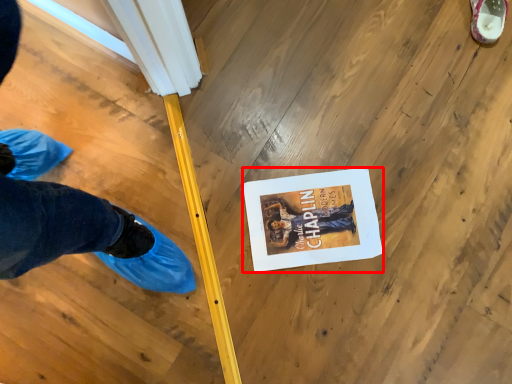
Question: Where is magazine (annotated by the red box) located in relation to footwear in the image?

Choices:
 (A) left
 (B) right

Answer: (A)